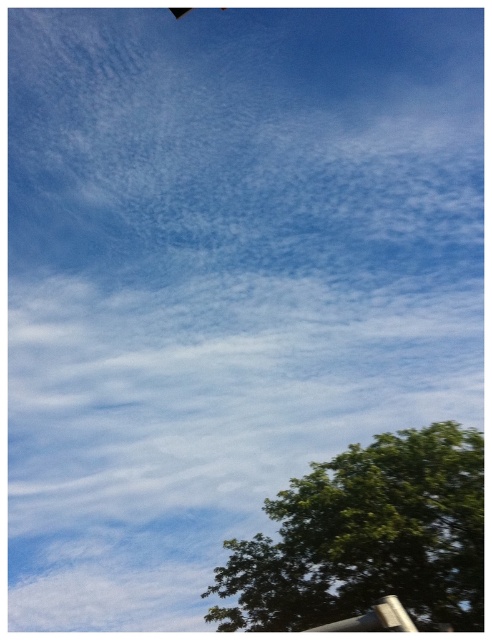
You are standing in the middle of the image and want to walk towards the green leafy tree at lower right and the brushed metal pole at lower right. Which one will you reach first?

The green leafy tree at lower right is to the right of the brushed metal pole at lower right, so you will reach the brushed metal pole at lower right first since it is closer to your starting position in the middle.

You are a bird looking for a perch. You see the green leafy tree at lower right and the brushed metal pole at lower right. Which one is taller for you to land on?

The green leafy tree at lower right has a lesser height compared to the brushed metal pole at lower right, so the brushed metal pole at lower right is taller and suitable for landing.